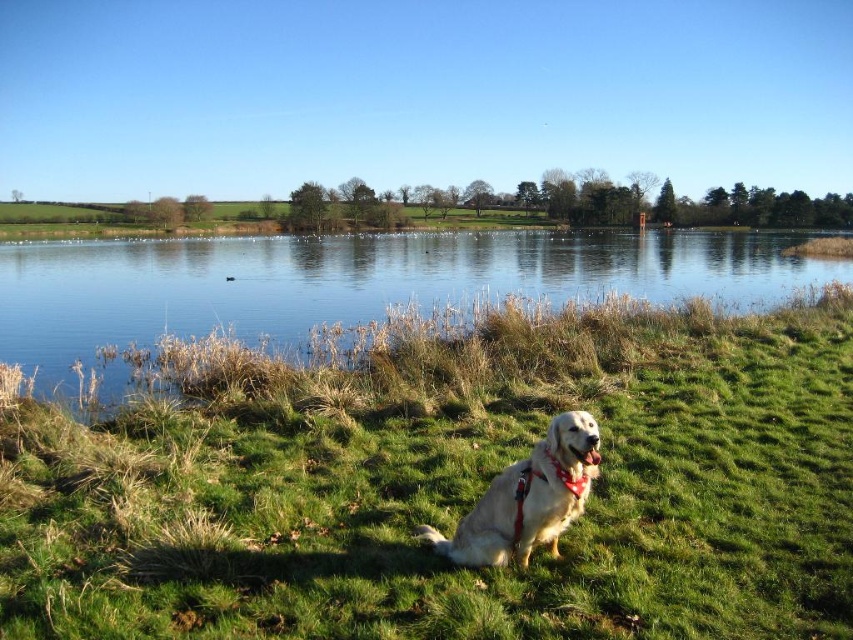
Does green grassy at lower center have a greater height compared to golden fur dog at lower center?

Indeed, green grassy at lower center has a greater height compared to golden fur dog at lower center.

Does green grassy at lower center lie in front of golden fur dog at lower center?

That is True.

Does point (799, 371) come behind point (440, 545)?

Yes, point (799, 371) is behind point (440, 545).

Find the location of a particular element. The width and height of the screenshot is (853, 640). green grassy at lower center is located at coordinates (450, 486).

Can you confirm if clear water at lake center is positioned above golden fur dog at lower center?

Correct, clear water at lake center is located above golden fur dog at lower center.

Is clear water at lake center wider than golden fur dog at lower center?

Correct, the width of clear water at lake center exceeds that of golden fur dog at lower center.

Between point (698, 280) and point (537, 504), which one is positioned in front?

Point (537, 504) is in front.

Where is `clear water at lake center`? clear water at lake center is located at coordinates [352, 282].

Which is behind, point (171, 500) or point (480, 285)?

The point (480, 285) is more distant.

Can you confirm if green grassy at lower center is smaller than clear water at lake center?

Correct, green grassy at lower center occupies less space than clear water at lake center.

Where is `green grassy at lower center`? The image size is (853, 640). green grassy at lower center is located at coordinates (450, 486).